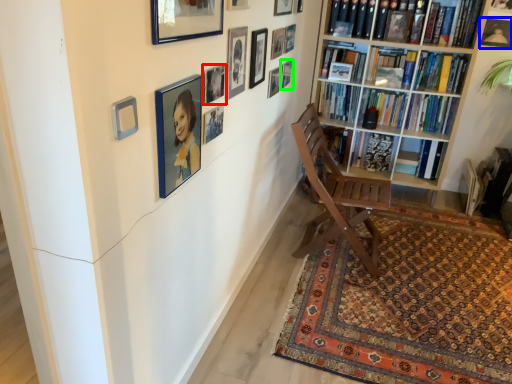
Question: Considering the real-world distances, which object is closest to picture frame (highlighted by a red box)? picture frame (highlighted by a blue box) or picture frame (highlighted by a green box).

Choices:
 (A) picture frame
 (B) picture frame

Answer: (B)